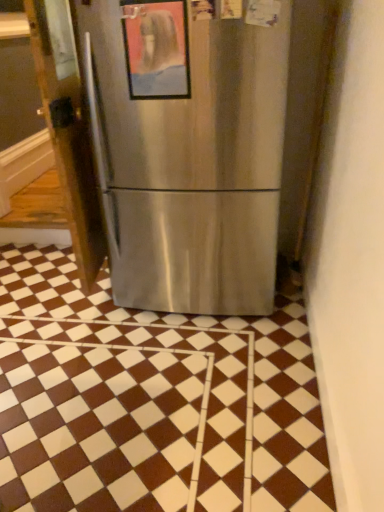
In order to click on free point above brown/white checkered tile at center (from a real-world perspective) in this screenshot , I will do `click(122, 345)`.